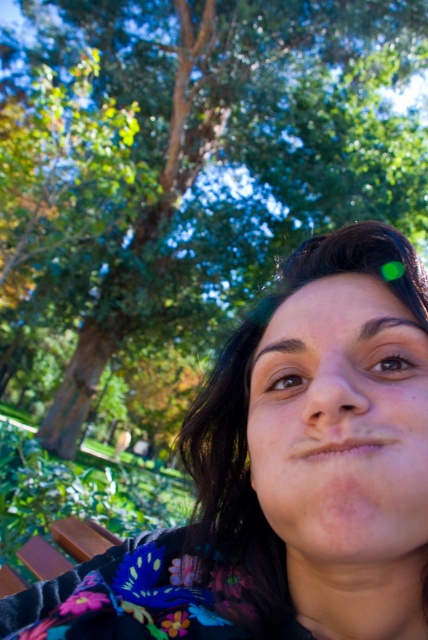
You are planning to take a photo of the floral fabric at center and the green leafy tree at upper center. Based on their positions, which object is closer to the camera?

The floral fabric at center is positioned under green leafy tree at upper center, so the floral fabric at center is closer to the camera than the green leafy tree at upper center.

You are a photographer trying to focus on two points in the image, point 1 at coordinates point (x=276, y=444) and point 2 at coordinates point (x=220, y=28). Which point is closer to the camera?

Point (x=276, y=444) is closer to the camera than point (x=220, y=28).